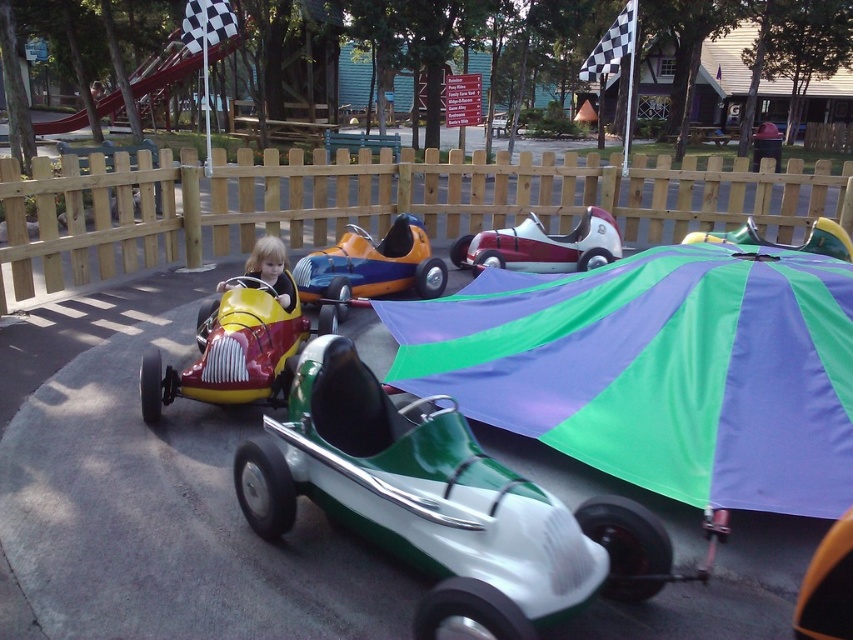
You are a parent standing at the edge of the amusement park area. You want to hand your child a juice box that is placed on the shiny red toy car at center. Can you reach it without moving closer? Assume your arm can extend 1.2 meters.

The shiny red toy car at center is 3.45 meters away from you. Since your arm can only extend 1.2 meters, you cannot reach the juice box on the shiny red toy car at center without moving closer.